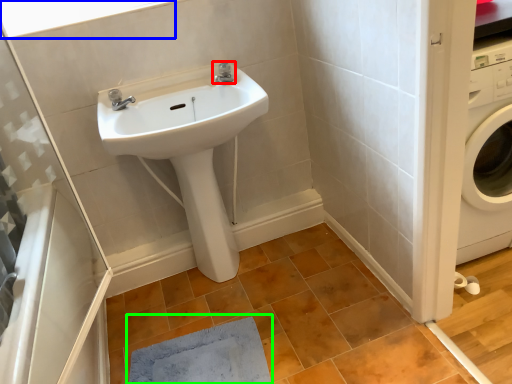
Question: Which is nearer to the tap (highlighted by a red box)? window (highlighted by a blue box) or doormat (highlighted by a green box).

Choices:
 (A) window
 (B) doormat

Answer: (A)